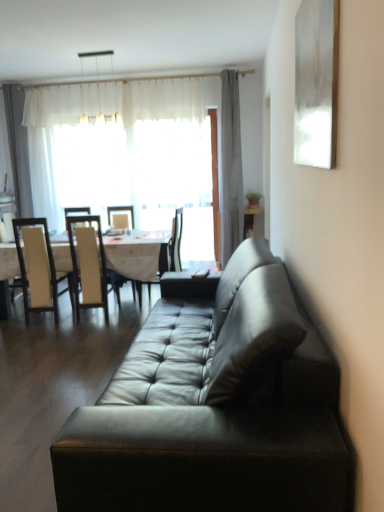
Identify the location of leather couch at center. (215, 410).

The image size is (384, 512). Find the location of `white leather chair at left, which ranks as the second chair in left-to-right order`. white leather chair at left, which ranks as the second chair in left-to-right order is located at coordinates (90, 264).

Measure the distance between point (39, 132) and camera.

They are 5.25 meters apart.

Describe the element at coordinates (127, 156) in the screenshot. I see `white sheer curtain at upper left` at that location.

Where is `white glossy table at center`? The image size is (384, 512). white glossy table at center is located at coordinates (138, 255).

What do you see at coordinates (39, 268) in the screenshot?
I see `white leather chair at left, the third chair viewed from the right` at bounding box center [39, 268].

The width and height of the screenshot is (384, 512). What are the coordinates of `gray fabric curtain at upper center` in the screenshot? It's located at (231, 166).

Considering the relative sizes of white glossy table at center and leather couch at center in the image provided, is white glossy table at center bigger than leather couch at center?

No, white glossy table at center is not bigger than leather couch at center.

From a real-world perspective, which object stands above the other?

leather couch at center is physically above.

Does white glossy table at center appear on the left side of leather couch at center?

Yes.

Based on the photo, can you tell me how much white glossy table at center and leather couch at center differ in facing direction?

93.1 degrees.

From a real-world perspective, count 1st chairs downward from the gray fabric curtain at upper center and point to it. Please provide its 2D coordinates.

[(39, 268)]

Can you tell me how much white leather chair at left, the third chair viewed from the right, and gray fabric curtain at upper center differ in facing direction?

white leather chair at left, the third chair viewed from the right, and gray fabric curtain at upper center are facing 5.1 degrees away from each other.

Is the position of white leather chair at left, the third chair viewed from the right, less distant than that of gray fabric curtain at upper center?

Yes, white leather chair at left, the third chair viewed from the right, is closer to the viewer.

Does white leather chair at left, which appears as the 1th chair when viewed from the left, have a greater width compared to gray fabric curtain at upper center?

Correct, the width of white leather chair at left, which appears as the 1th chair when viewed from the left, exceeds that of gray fabric curtain at upper center.

Looking at their sizes, would you say leather couch at center is wider or thinner than white glossy table at center?

Clearly, leather couch at center has more width compared to white glossy table at center.

Are leather couch at center and white glossy table at center located far from each other?

Yes, leather couch at center and white glossy table at center are quite far apart.

From the picture: Is leather couch at center oriented away from white glossy table at center?

No.

Is point (164, 435) closer or farther from the camera than point (131, 271)?

Point (164, 435) appears to be closer to the viewer than point (131, 271).

How many degrees apart are the facing directions of white glossy table at center and gray fabric curtain at upper center?

The facing directions of white glossy table at center and gray fabric curtain at upper center are 4.63 degrees apart.

Considering the positions of point (144, 268) and point (229, 136), is point (144, 268) closer or farther from the camera than point (229, 136)?

Point (144, 268) appears to be closer to the viewer than point (229, 136).

From a real-world perspective, relative to gray fabric curtain at upper center, is white glossy table at center vertically above or below?

In terms of real-world spatial position, white glossy table at center is below gray fabric curtain at upper center.

Can you confirm if white glossy table at center is smaller than gray fabric curtain at upper center?

No, white glossy table at center is not smaller than gray fabric curtain at upper center.

In terms of width, does black leather chair at center, which ranks as the 3th chair in left-to-right order, look wider or thinner when compared to white glossy table at center?

black leather chair at center, which ranks as the 3th chair in left-to-right order, is thinner than white glossy table at center.

Between point (140, 282) and point (64, 249), which one is positioned behind?

Positioned behind is point (140, 282).

Consider the image. Which object is closer to the camera taking this photo, black leather chair at center, acting as the first chair starting from the right, or white glossy table at center?

Positioned in front is white glossy table at center.

Which of these two, black leather chair at center, which ranks as the 3th chair in left-to-right order, or white glossy table at center, is smaller?

black leather chair at center, which ranks as the 3th chair in left-to-right order, is smaller.

Does gray fabric curtain at upper center come behind white leather chair at left, the third chair viewed from the right?

Yes, it is behind white leather chair at left, the third chair viewed from the right.

From a real-world perspective, which chair is the 1st one underneath the gray fabric curtain at upper center? Please provide its 2D coordinates.

[(39, 268)]

Is gray fabric curtain at upper center facing away from white leather chair at left, which appears as the 1th chair when viewed from the left?

No, gray fabric curtain at upper center is not facing the opposite direction of white leather chair at left, which appears as the 1th chair when viewed from the left.

From the image's perspective, is white sheer curtain at upper left above or below white leather chair at left, the third chair viewed from the right?

Based on their image positions, white sheer curtain at upper left is located above white leather chair at left, the third chair viewed from the right.

Which object is closer to the camera, white sheer curtain at upper left or white leather chair at left, the third chair viewed from the right?

white leather chair at left, the third chair viewed from the right, is closer to the camera.

Is white sheer curtain at upper left not near white leather chair at left, which appears as the 1th chair when viewed from the left?

Yes, white sheer curtain at upper left and white leather chair at left, which appears as the 1th chair when viewed from the left, are located far from each other.

Which is nearer, (27, 92) or (33, 240)?

Clearly, point (27, 92) is more distant from the camera than point (33, 240).

Locate an element on the screen. studio couch that appears in front of the white glossy table at center is located at coordinates (215, 410).

Find the location of a particular element. This screenshot has height=512, width=384. curtain on the right of white leather chair at left, the third chair viewed from the right is located at coordinates click(231, 166).

Estimate the real-world distances between objects in this image. Which object is further from leather couch at center, white glossy table at center or white sheer curtain at upper left?

white sheer curtain at upper left.

Estimate the real-world distances between objects in this image. Which object is closer to white leather chair at left, the third chair viewed from the right, gray fabric curtain at upper center or black leather chair at center, acting as the first chair starting from the right?

black leather chair at center, acting as the first chair starting from the right, is positioned closer to the anchor white leather chair at left, the third chair viewed from the right.

Looking at the image, which one is located further to white leather chair at left, marked as the 2th chair in a right-to-left arrangement, white sheer curtain at upper left or gray fabric curtain at upper center?

Based on the image, gray fabric curtain at upper center appears to be further to white leather chair at left, marked as the 2th chair in a right-to-left arrangement.

Which object lies further to the anchor point white leather chair at left, which ranks as the second chair in left-to-right order, black leather chair at center, acting as the first chair starting from the right, or white sheer curtain at upper left?

Based on the image, white sheer curtain at upper left appears to be further to white leather chair at left, which ranks as the second chair in left-to-right order.

Looking at the image, which one is located closer to white glossy table at center, white sheer curtain at upper left or black leather chair at center, acting as the first chair starting from the right?

black leather chair at center, acting as the first chair starting from the right, is closer to white glossy table at center.

Considering their positions, is white sheer curtain at upper left positioned further to black leather chair at center, acting as the first chair starting from the right, than gray fabric curtain at upper center?

white sheer curtain at upper left is further to black leather chair at center, acting as the first chair starting from the right.

From the image, which object appears to be nearer to gray fabric curtain at upper center, black leather chair at center, which ranks as the 3th chair in left-to-right order, or white sheer curtain at upper left?

white sheer curtain at upper left lies closer to gray fabric curtain at upper center than the other object.

When comparing their distances from leather couch at center, does white leather chair at left, which ranks as the second chair in left-to-right order, or white sheer curtain at upper left seem further?

white sheer curtain at upper left is positioned further to the anchor leather couch at center.

This screenshot has height=512, width=384. I want to click on kitchen & dining room table situated between white leather chair at left, the third chair viewed from the right, and black leather chair at center, acting as the first chair starting from the right, from left to right, so pos(138,255).

Locate an element on the screen. This screenshot has width=384, height=512. curtain positioned between leather couch at center and white sheer curtain at upper left from near to far is located at coordinates (231, 166).

The image size is (384, 512). In order to click on chair between white glossy table at center and black leather chair at center, acting as the first chair starting from the right, in the horizontal direction in this screenshot , I will do `click(90, 264)`.

Identify the location of kitchen & dining room table between white leather chair at left, the third chair viewed from the right, and white sheer curtain at upper left, along the z-axis. (138, 255).